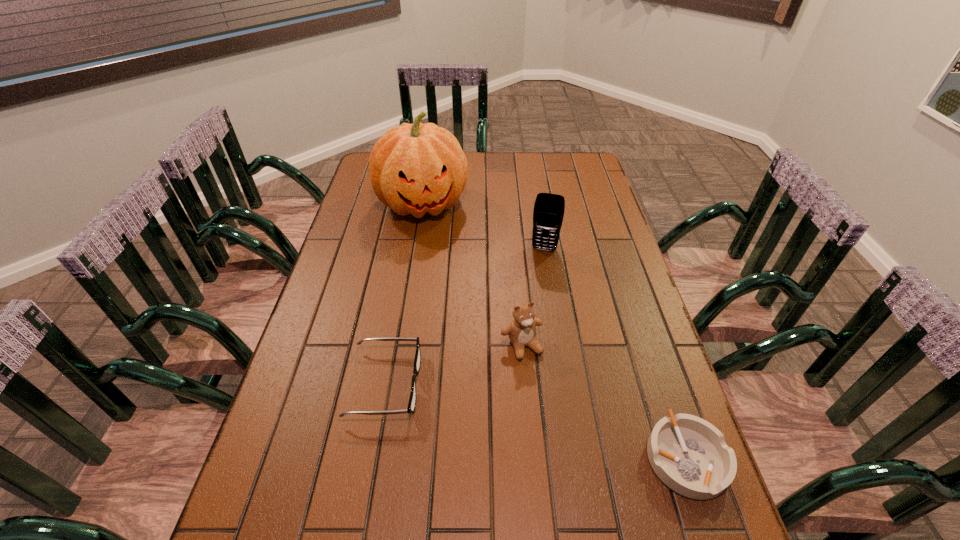
Where is `empty space that is in between the farthest object and the fourth tallest object`? empty space that is in between the farthest object and the fourth tallest object is located at coordinates (404, 294).

Point out which object is positioned as the second nearest to the spectacles. Please provide its 2D coordinates. Your answer should be formatted as a tuple, i.e. [(x, y)], where the tuple contains the x and y coordinates of a point satisfying the conditions above.

[(548, 213)]

At what (x,y) coordinates should I click in order to perform the action: click on object that can be found as the third closest to the ashtray. Please return your answer as a coordinate pair (x, y). Looking at the image, I should click on (548, 213).

Where is `blank area in the image that satisfies the following two spatial constraints: 1. on the back side of the second farthest object; 2. on the left side of the teddy bear`? The image size is (960, 540). blank area in the image that satisfies the following two spatial constraints: 1. on the back side of the second farthest object; 2. on the left side of the teddy bear is located at coordinates (514, 249).